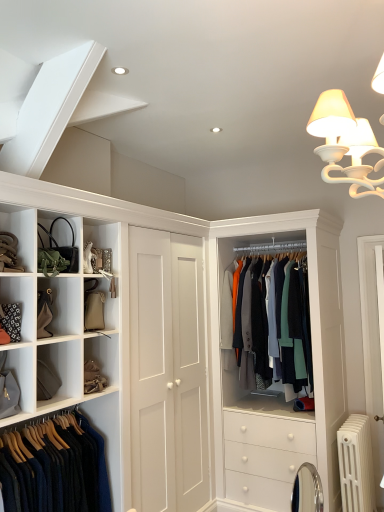
Question: Is matte gray bag at lower left next to dark blue wool sweater at lower left, which ranks as the 2th clothing in back-to-front order?

Choices:
 (A) no
 (B) yes

Answer: (A)

Question: From the image's perspective, is matte gray bag at lower left located above dark blue wool sweater at lower left, the second clothing positioned from the right?

Choices:
 (A) no
 (B) yes

Answer: (B)

Question: Is matte gray bag at lower left at the right side of dark blue wool sweater at lower left, the second clothing positioned from the right?

Choices:
 (A) yes
 (B) no

Answer: (B)

Question: From the image's perspective, is matte gray bag at lower left under dark blue wool sweater at lower left, which ranks as the first clothing in front-to-back order?

Choices:
 (A) no
 (B) yes

Answer: (A)

Question: From a real-world perspective, is matte gray bag at lower left on top of dark blue wool sweater at lower left, which ranks as the first clothing in front-to-back order?

Choices:
 (A) yes
 (B) no

Answer: (A)

Question: Is point (x=94, y=452) positioned closer to the camera than point (x=13, y=362)?

Choices:
 (A) closer
 (B) farther

Answer: (B)

Question: From the image's perspective, relative to matte gray bag at lower left, is dark blue wool sweater at lower left, which ranks as the 2th clothing in back-to-front order, above or below?

Choices:
 (A) below
 (B) above

Answer: (A)

Question: Considering the positions of dark blue wool sweater at lower left, which ranks as the 2th clothing in back-to-front order, and matte gray bag at lower left in the image, is dark blue wool sweater at lower left, which ranks as the 2th clothing in back-to-front order, taller or shorter than matte gray bag at lower left?

Choices:
 (A) tall
 (B) short

Answer: (A)

Question: Which is correct: dark blue wool sweater at lower left, which ranks as the 2th clothing in back-to-front order, is inside matte gray bag at lower left, or outside of it?

Choices:
 (A) inside
 (B) outside

Answer: (B)

Question: Is white metallic radiator at lower right inside the boundaries of matte black handbag at upper left, or outside?

Choices:
 (A) inside
 (B) outside

Answer: (B)

Question: In terms of size, does white metallic radiator at lower right appear bigger or smaller than matte black handbag at upper left?

Choices:
 (A) big
 (B) small

Answer: (A)

Question: In terms of width, does white metallic radiator at lower right look wider or thinner when compared to matte black handbag at upper left?

Choices:
 (A) wide
 (B) thin

Answer: (A)

Question: From the image's perspective, is white metallic radiator at lower right positioned above or below matte black handbag at upper left?

Choices:
 (A) above
 (B) below

Answer: (B)

Question: Is textured wool coat at center, which ranks as the first clothing in right-to-left order, spatially inside matte black handbag at upper left, or outside of it?

Choices:
 (A) outside
 (B) inside

Answer: (A)

Question: In terms of height, does textured wool coat at center, the 2th clothing positioned from the front, look taller or shorter compared to matte black handbag at upper left?

Choices:
 (A) short
 (B) tall

Answer: (B)